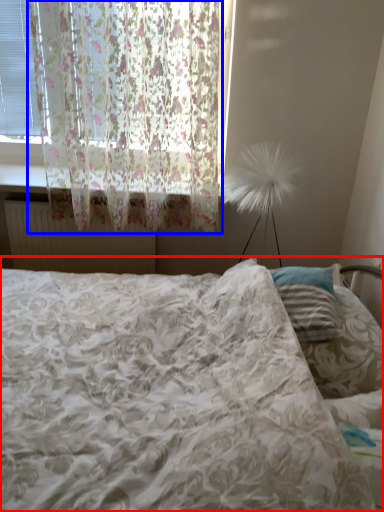
Question: Which of the following is the closest to the observer, bed (highlighted by a red box) or curtain (highlighted by a blue box)?

Choices:
 (A) bed
 (B) curtain

Answer: (A)